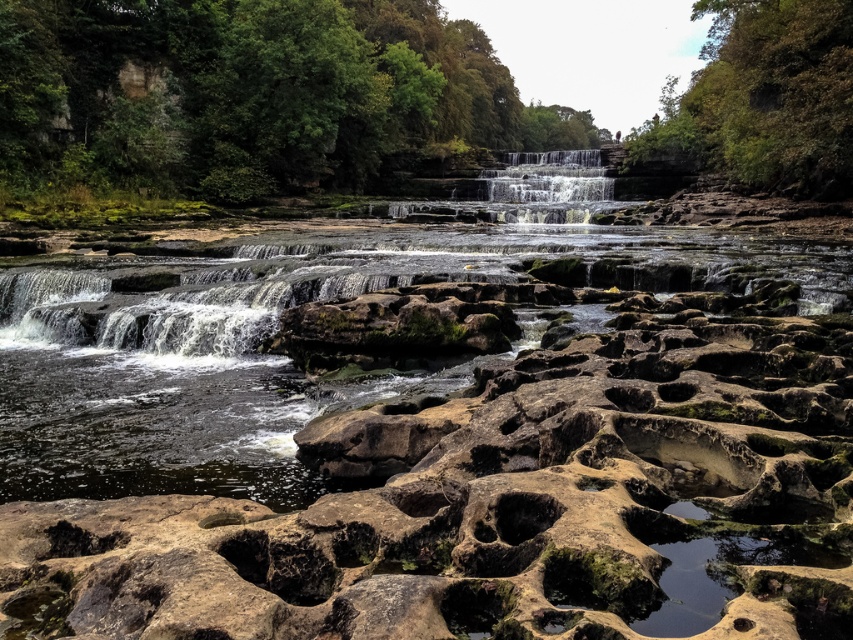
Question: Is green leafy tree at upper center to the left of smooth stone waterfall at center from the viewer's perspective?

Choices:
 (A) no
 (B) yes

Answer: (A)

Question: Which point is farther to the camera?

Choices:
 (A) brown rock river at center
 (B) smooth stone waterfall at center
 (C) green leafy tree at upper center

Answer: (B)

Question: Which object is farther from the camera taking this photo?

Choices:
 (A) brown rock river at center
 (B) green leafy tree at upper right
 (C) smooth stone waterfall at center
 (D) green leafy tree at upper center

Answer: (C)

Question: Does green leafy tree at upper right have a smaller size compared to smooth stone waterfall at center?

Choices:
 (A) no
 (B) yes

Answer: (A)

Question: Which is farther from the green leafy tree at upper center?

Choices:
 (A) smooth stone waterfall at center
 (B) green leafy tree at upper right
 (C) brown rock river at center

Answer: (C)

Question: Can you confirm if green leafy tree at upper center is positioned below green leafy tree at upper right?

Choices:
 (A) yes
 (B) no

Answer: (A)